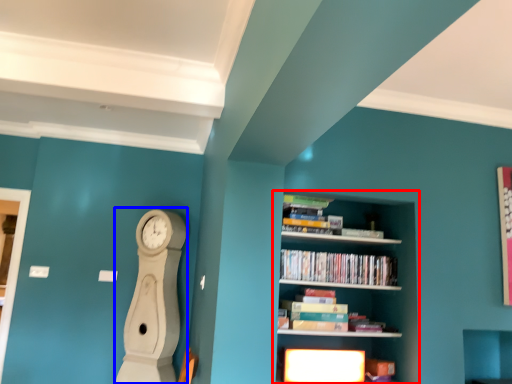
Question: Which object appears farthest to the camera in this image, shelf (highlighted by a red box) or clock (highlighted by a blue box)?

Choices:
 (A) shelf
 (B) clock

Answer: (B)